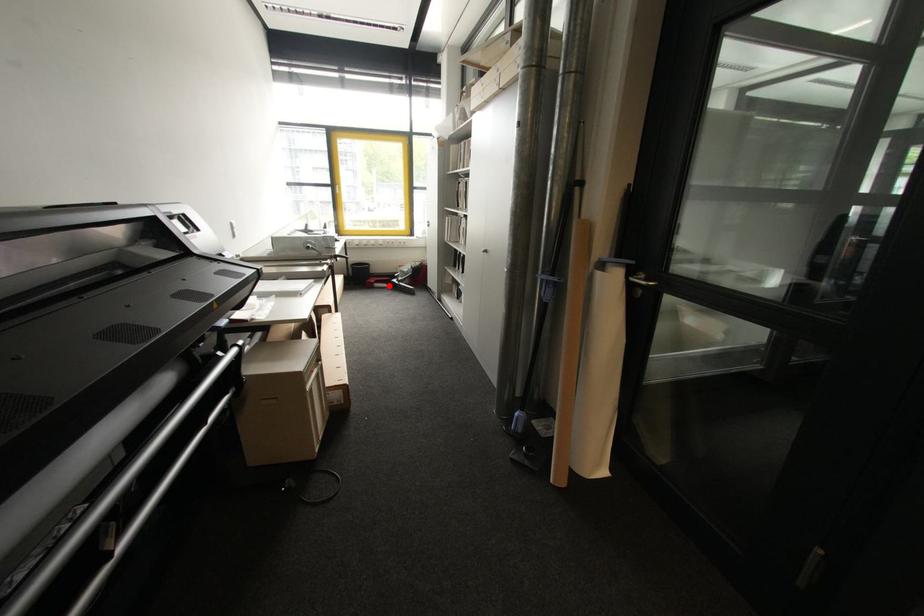
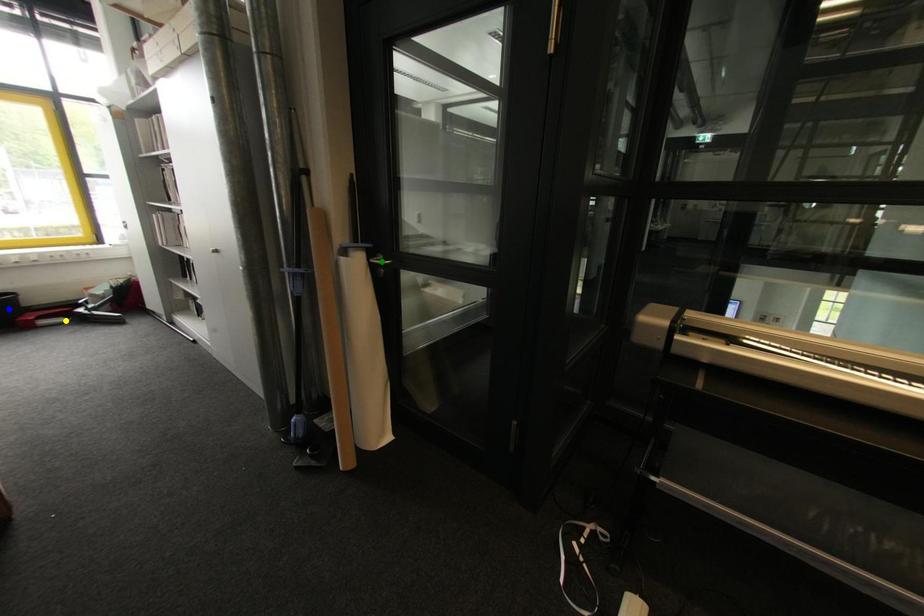
Question: I am providing you with two images of the same scene from different viewpoints. A red point is marked on the first image. You are given multiple points on the second image. Which point in image 2 is actually the same real-world point as the red point in image 1?

Choices:
 (A) blue point
 (B) yellow point
 (C) green point

Answer: (B)